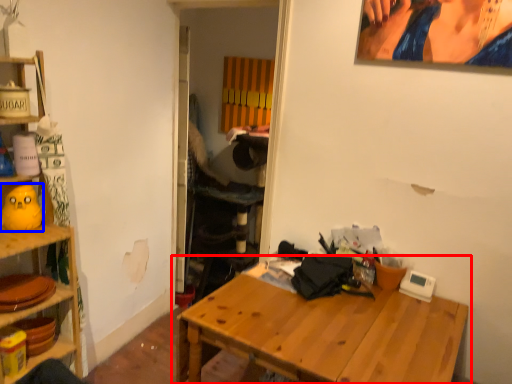
Question: Which of the following is the closest to the observer, table (highlighted by a red box) or toy (highlighted by a blue box)?

Choices:
 (A) table
 (B) toy

Answer: (A)